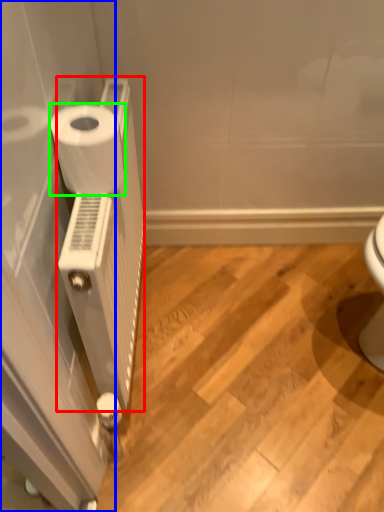
Question: Which is farther away from radiator (highlighted by a red box)? screen door (highlighted by a blue box) or toilet paper (highlighted by a green box)?

Choices:
 (A) screen door
 (B) toilet paper

Answer: (B)